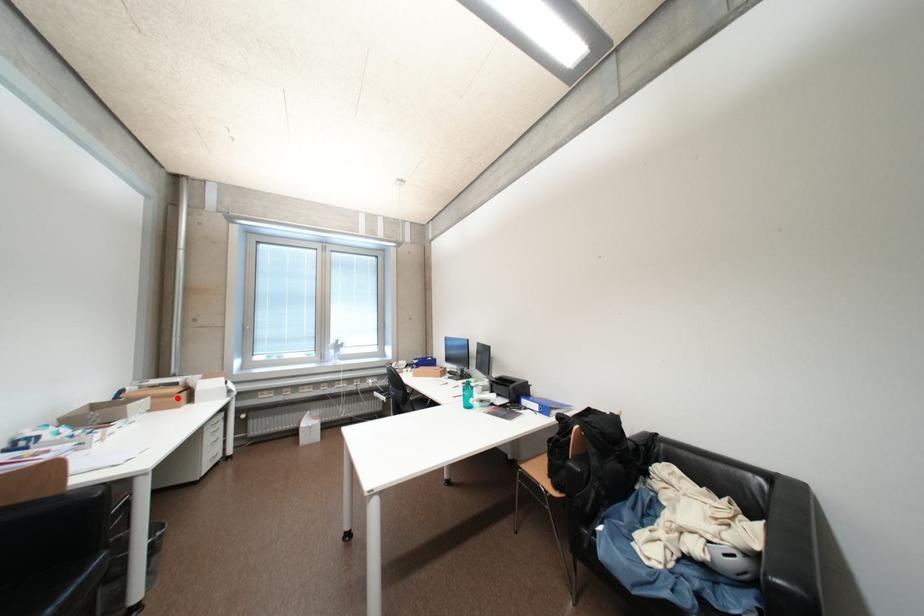
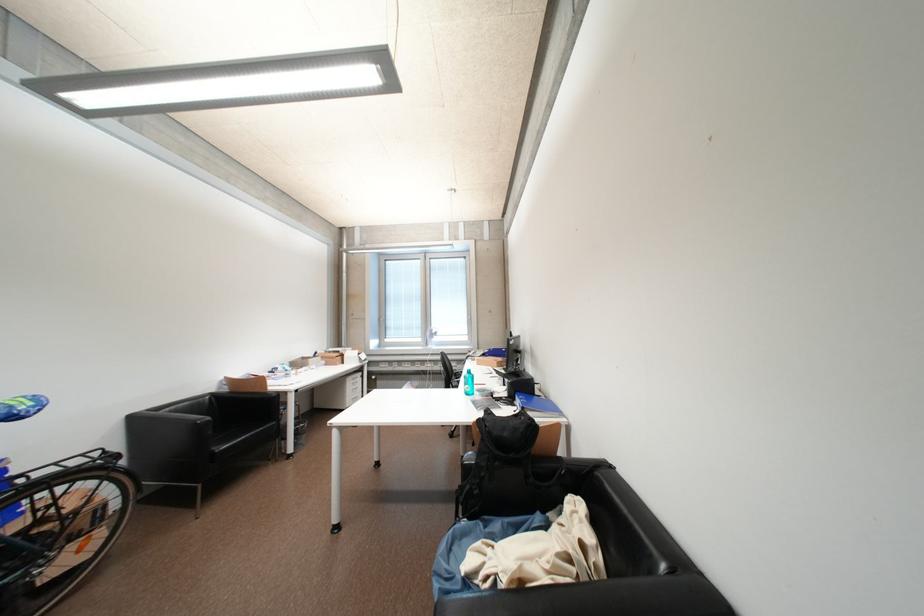
Locate, in the second image, the point that corresponds to the highlighted location in the first image.

(341, 360)